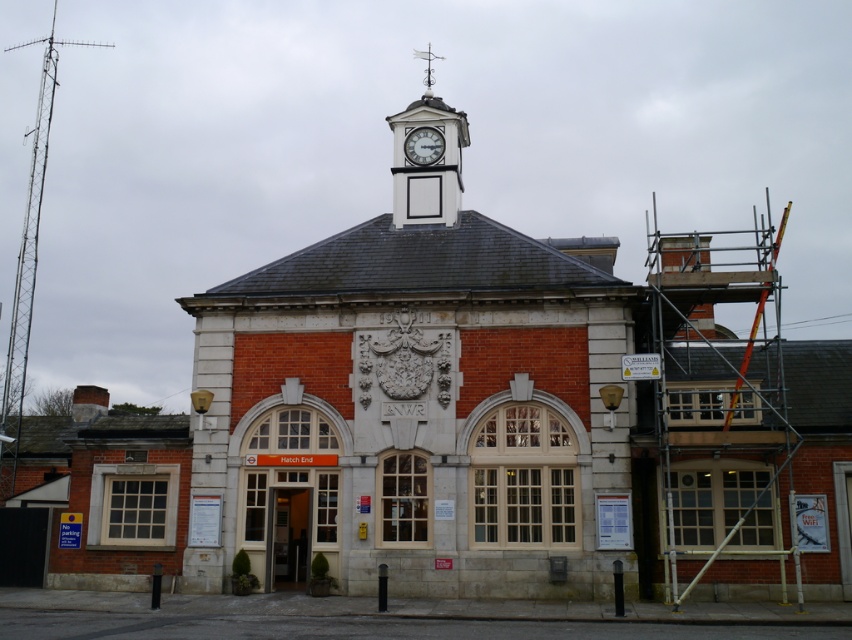
You are an architect inspecting the building facade. You notice the white painted wood clock tower at upper center and the white glossy clock at upper center. Which of these two objects is bigger in size?

The white painted wood clock tower at upper center is larger in size compared to the white glossy clock at upper center.

You are an architect inspecting the building. You notice the white painted wood clock tower at upper center and the white glossy clock at upper center. Which one is located more to the left?

The white painted wood clock tower at upper center is positioned on the left side of white glossy clock at upper center, so it is more to the left.

You are standing in front of the traditional brick building with a clock tower. Where is the white painted wood clock tower at upper center positioned relative to the building?

The white painted wood clock tower at upper center is positioned at the central part of the building, specifically at coordinates point (427, 157).